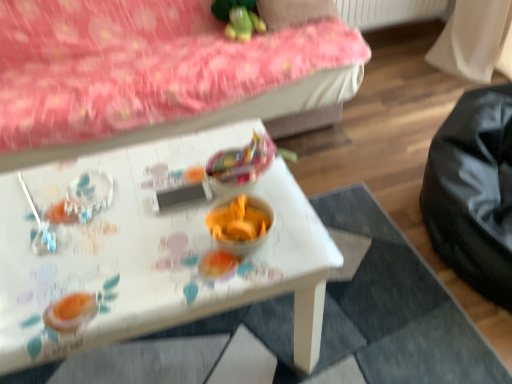
Identify the location of vacant area situated to the left side of shiny plastic candy at center. coord(161,188).